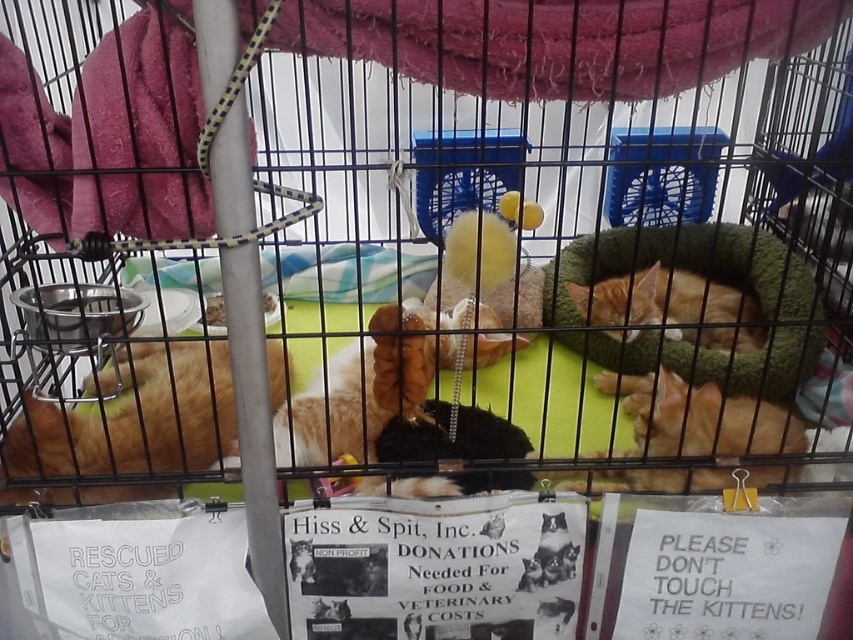
Is point (194, 467) positioned after point (416, 154)?

No, it is not.

What do you see at coordinates (141, 413) in the screenshot? I see `orange fur cat at left` at bounding box center [141, 413].

The height and width of the screenshot is (640, 853). What are the coordinates of `orange fur cat at left` in the screenshot? It's located at (141, 413).

Is orange fur cat at center to the right of fluffy orange cat at center from the viewer's perspective?

Yes, orange fur cat at center is to the right of fluffy orange cat at center.

Who is lower down, orange fur cat at center or fluffy orange cat at center?

fluffy orange cat at center

Who is more forward, (688, 326) or (285, 417)?

Point (688, 326)

At what (x,y) coordinates should I click in order to perform the action: click on orange fur cat at center. Please return your answer as a coordinate pair (x, y). The height and width of the screenshot is (640, 853). Looking at the image, I should click on (674, 307).

In the scene shown: Can you confirm if blue plastic bird cage at upper center is thinner than orange fur cat at center?

In fact, blue plastic bird cage at upper center might be wider than orange fur cat at center.

Consider the image. Between blue plastic bird cage at upper center and orange fur cat at center, which one is positioned higher?

blue plastic bird cage at upper center

Where is `blue plastic bird cage at upper center`? The height and width of the screenshot is (640, 853). blue plastic bird cage at upper center is located at coordinates (660, 173).

The image size is (853, 640). What are the coordinates of `blue plastic bird cage at upper center` in the screenshot? It's located at (660, 173).